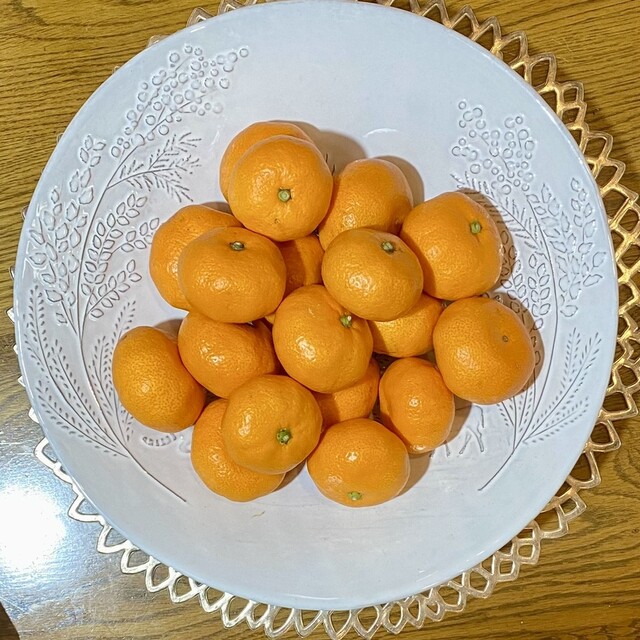
Where is `metallic placemat`? Image resolution: width=640 pixels, height=640 pixels. metallic placemat is located at coordinates (451, 608).